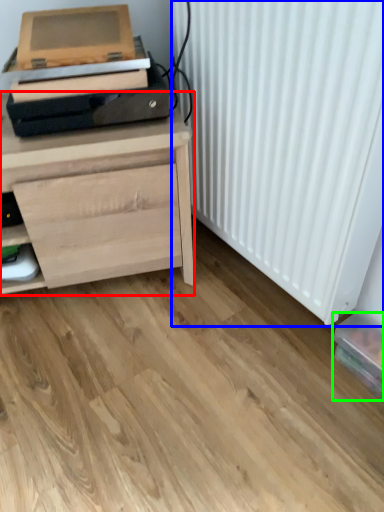
Question: Which is nearer to the chest of drawers (highlighted by a red box)? radiator (highlighted by a blue box) or box (highlighted by a green box).

Choices:
 (A) radiator
 (B) box

Answer: (A)